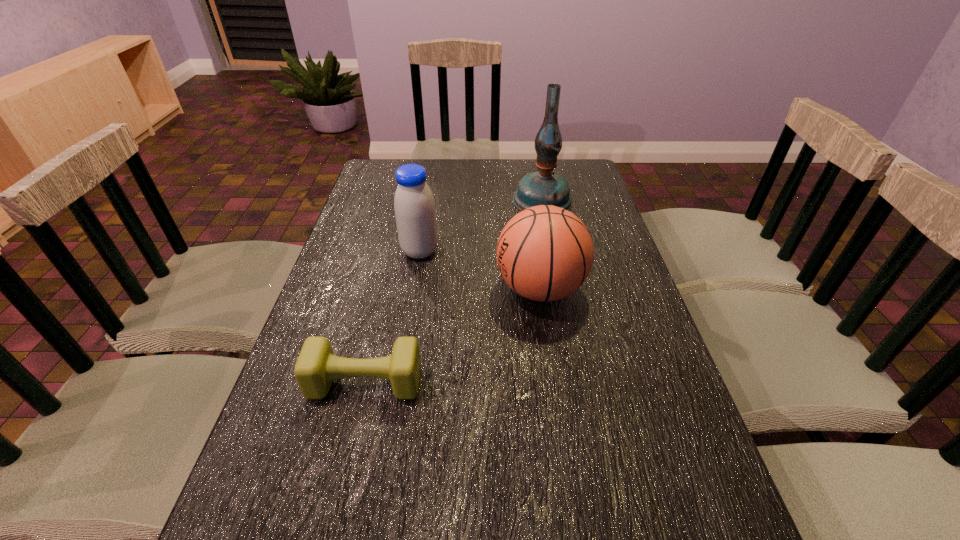
You are a GUI agent. You are given a task and a screenshot of the screen. Output one action in this format:
    pyautogui.click(x=<x>, y=<y>)
    Task: Click on the farthest object
    Image resolution: width=960 pixels, height=540 pixels.
    Given the screenshot: What is the action you would take?
    pyautogui.click(x=543, y=187)

Identify the location of oil lamp. The image size is (960, 540). (543, 187).

Find the location of a particular element. soya milk is located at coordinates (414, 205).

The image size is (960, 540). What are the coordinates of `basketball` in the screenshot? It's located at (544, 253).

Find the location of `the shortest object`. the shortest object is located at coordinates (x=316, y=367).

This screenshot has width=960, height=540. In order to click on dumbbell in this screenshot , I will do `click(316, 367)`.

The height and width of the screenshot is (540, 960). Find the location of `free spot located 0.130m on the front of the oil lamp`. free spot located 0.130m on the front of the oil lamp is located at coordinates (551, 241).

You are a GUI agent. You are given a task and a screenshot of the screen. Output one action in this format:
    pyautogui.click(x=<x>, y=<y>)
    Task: Click on the free point located on the front of the soya milk
    This screenshot has width=960, height=540.
    Given the screenshot: What is the action you would take?
    pyautogui.click(x=413, y=293)

The height and width of the screenshot is (540, 960). In order to click on vacant point located on the surface of the basketball near the brand logo in this screenshot , I will do `click(453, 289)`.

What are the coordinates of `free location located 0.290m on the surface of the basketball near the brand logo` in the screenshot? It's located at (384, 289).